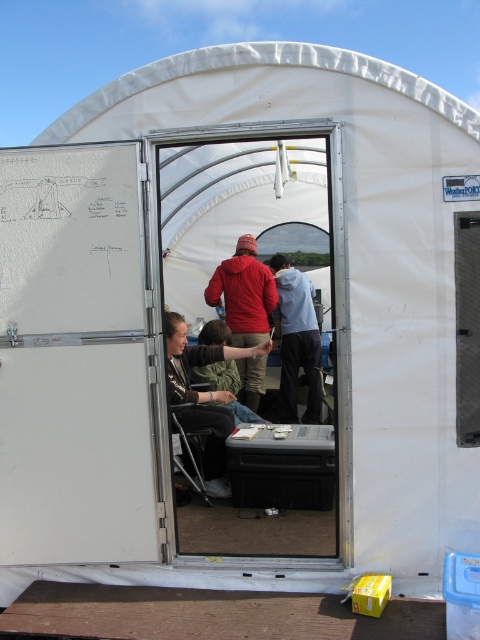
Question: Which object is closer to the camera taking this photo?

Choices:
 (A) light gray hoodie at center
 (B) black plastic trailer at center

Answer: (B)

Question: Among these objects, which one is farthest from the camera?

Choices:
 (A) transparent plastic screen door at center
 (B) black plastic trailer at center
 (C) light gray hoodie at center
 (D) brown fabric chair at center

Answer: (C)

Question: Can you confirm if white matte door at center is positioned to the right of light gray hoodie at center?

Choices:
 (A) no
 (B) yes

Answer: (A)

Question: Which is farther from the white matte door at center?

Choices:
 (A) transparent plastic screen door at center
 (B) brown fabric chair at center

Answer: (A)

Question: Does white matte door at center have a greater width compared to transparent plastic screen door at center?

Choices:
 (A) no
 (B) yes

Answer: (A)

Question: From the image, what is the correct spatial relationship of transparent plastic screen door at center in relation to matte red jacket at center?

Choices:
 (A) left
 (B) right

Answer: (A)